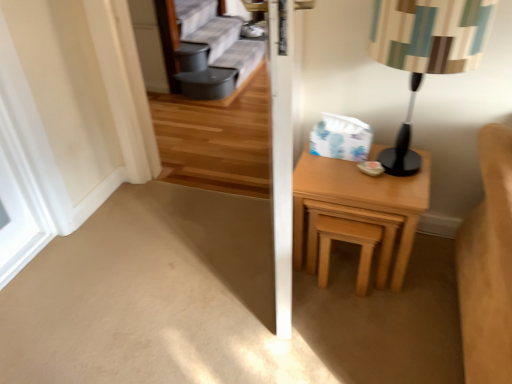
The image size is (512, 384). In order to click on blank space situated above light wood/texture nightstand at right (from a real-world perspective) in this screenshot , I will do `click(361, 165)`.